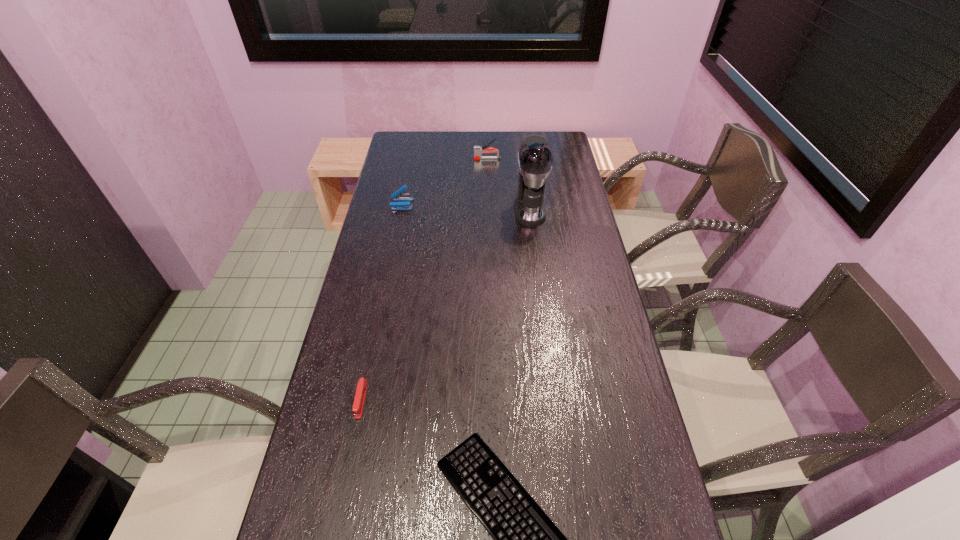
Find the location of a particular element. The width and height of the screenshot is (960, 540). blank region between the tallest stapler and the coffee maker is located at coordinates (509, 185).

I want to click on free point between the second tallest stapler and the tallest object, so click(x=466, y=207).

Identify the location of free space between the farthest object and the coffee maker. The width and height of the screenshot is (960, 540). (509, 185).

I want to click on free spot between the shortest stapler and the third shortest object, so click(x=382, y=302).

You are a GUI agent. You are given a task and a screenshot of the screen. Output one action in this format:
    pyautogui.click(x=<x>, y=<y>)
    Task: Click on the empty location between the tallest object and the nearest stapler
    This screenshot has height=540, width=960.
    Given the screenshot: What is the action you would take?
    pyautogui.click(x=445, y=305)

Find the location of a particular element. The width and height of the screenshot is (960, 540). free space between the coffee maker and the second tallest stapler is located at coordinates (466, 207).

Identify the location of the fourth closest object to the tallest object. The height and width of the screenshot is (540, 960). (525, 539).

Locate which object ranks in proximity to the fourth shortest object. Please provide its 2D coordinates. Your answer should be formatted as a tuple, i.e. [(x, y)], where the tuple contains the x and y coordinates of a point satisfying the conditions above.

[(535, 158)]

Identify the location of stapler that is the second closest to the fourth shortest object. coord(361,390).

Find the location of a particular element. stapler that is the second closest one to the third shortest object is located at coordinates (361, 390).